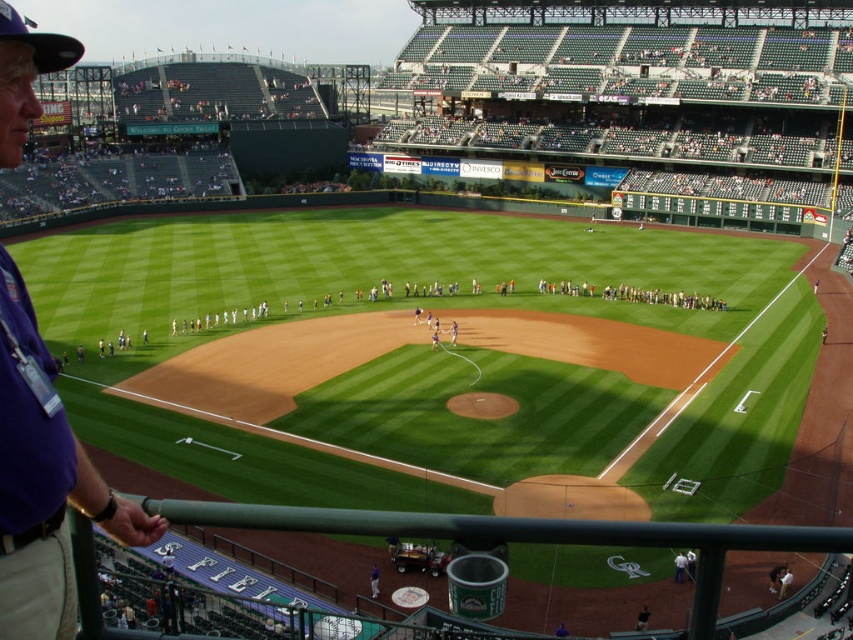
Does purple fabric shirt at left appear on the right side of blue uniformed man at center?

Incorrect, purple fabric shirt at left is not on the right side of blue uniformed man at center.

Is point (28, 324) more distant than point (370, 595)?

That is False.

This screenshot has width=853, height=640. I want to click on purple fabric shirt at left, so click(x=44, y=481).

Who is lower down, purple fabric shirt at left or white shirt at lower right?

white shirt at lower right

Between point (39, 554) and point (675, 557), which one is positioned behind?

Positioned behind is point (675, 557).

Identify the location of purple fabric shirt at left. (44, 481).

Can you confirm if purple fabric shirt at left is thinner than white uniform players at center?

Indeed, purple fabric shirt at left has a lesser width compared to white uniform players at center.

Is the position of purple fabric shirt at left more distant than that of white uniform players at center?

That is False.

Does point (4, 472) come closer to viewer compared to point (666, 305)?

Yes, it is in front of point (666, 305).

Locate an element on the screen. purple fabric shirt at left is located at coordinates (44, 481).